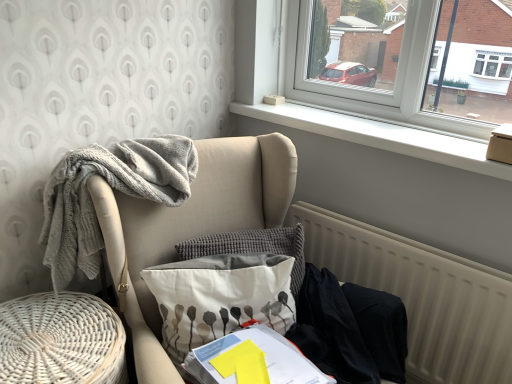
Question: Is point (210, 208) positioned closer to the camera than point (47, 332)?

Choices:
 (A) farther
 (B) closer

Answer: (A)

Question: Relative to white woven basket at lower left, is textured beige armchair at left in front or behind?

Choices:
 (A) behind
 (B) front

Answer: (B)

Question: Which is farther from the beige textured radiator at lower right?

Choices:
 (A) textured gray pillow at center, which is the 2th pillow in front-to-back order
 (B) white fabric pillow with gray floral pattern at center, the 2th pillow when ordered from back to front
 (C) black fabric at lower right
 (D) textured beige armchair at left
 (E) white woven basket at lower left

Answer: (E)

Question: Which of these objects is positioned closest to the textured gray pillow at center, which is the 2th pillow in front-to-back order?

Choices:
 (A) black fabric at lower right
 (B) beige textured radiator at lower right
 (C) white smooth window sill at upper center
 (D) white fabric pillow with gray floral pattern at center, placed as the first pillow when sorted from front to back
 (E) textured beige armchair at left

Answer: (D)